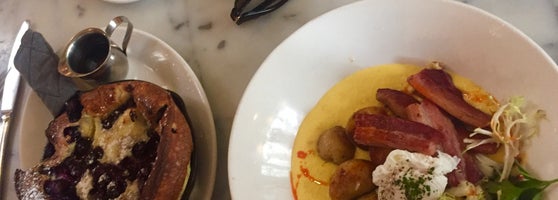
Image resolution: width=558 pixels, height=200 pixels. I want to click on nasty looking cream table, so click(x=244, y=48).